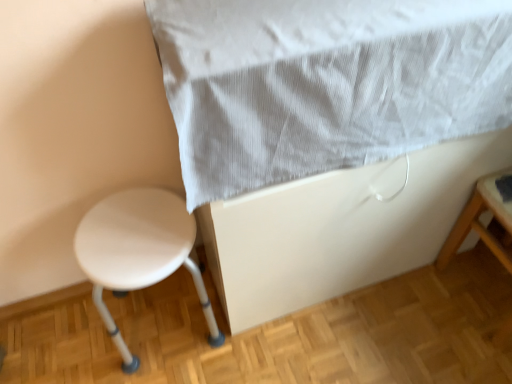
You are a GUI agent. You are given a task and a screenshot of the screen. Output one action in this format:
    pyautogui.click(x=<x>, y=<y>)
    Task: Click on the free spot to the left of white plastic stool at lower left
    
    Given the screenshot: What is the action you would take?
    pyautogui.click(x=74, y=341)